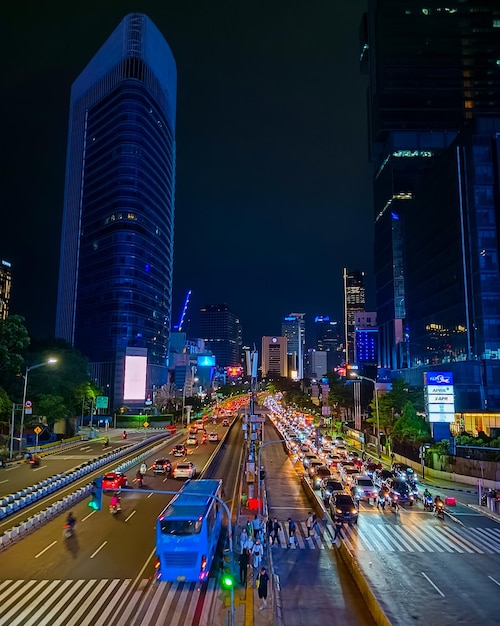
Where is `divider`? The width and height of the screenshot is (500, 626). divider is located at coordinates (279, 449).